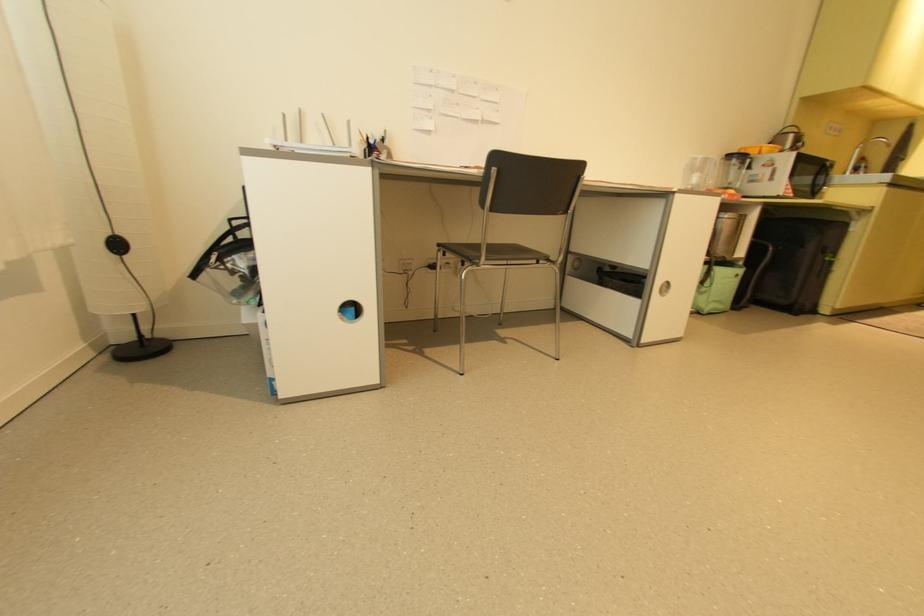
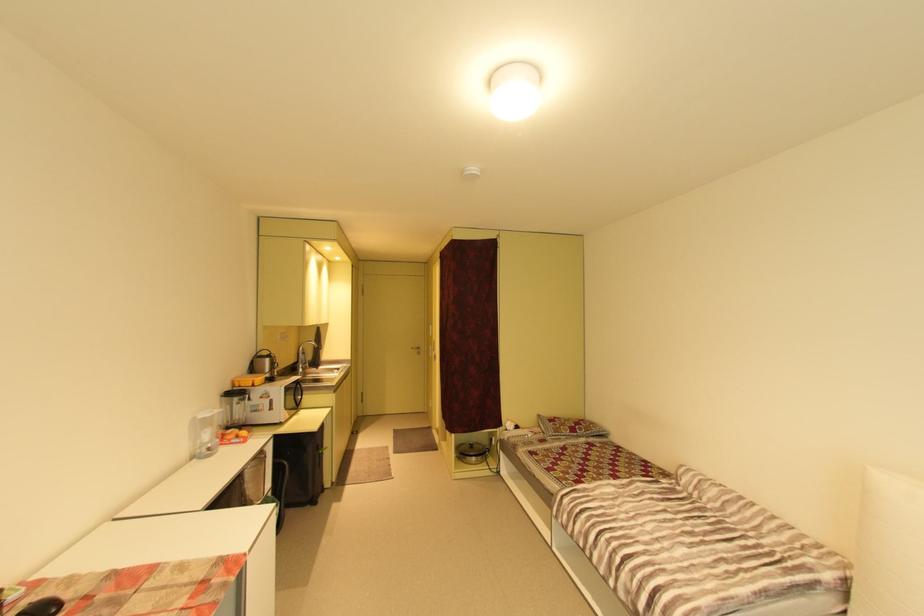
Where in the second image is the point corresponding to (752,150) from the first image?

(246, 381)